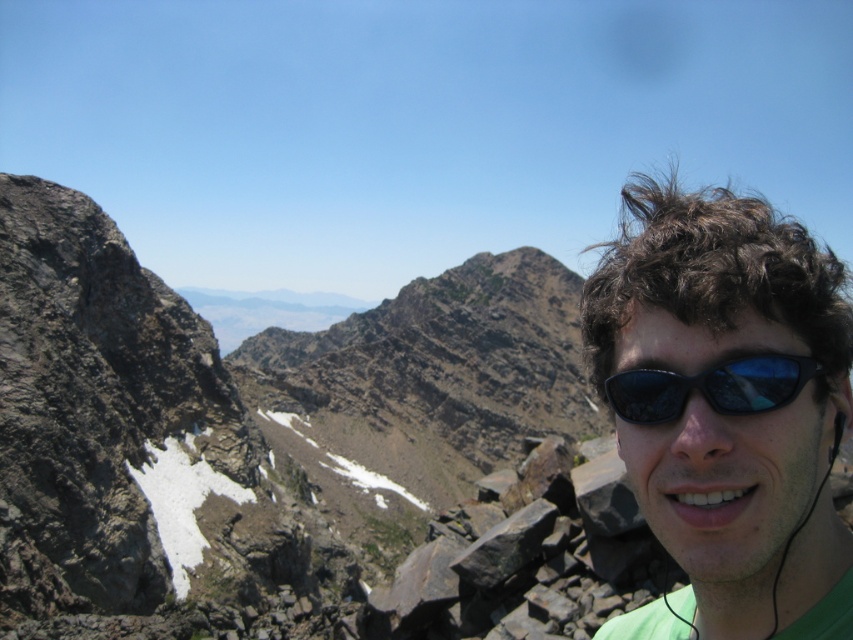
You are a photographer trying to capture the perfect shot of the green matte sunglasses at upper right and the black reflective sunglasses at right. Since you want to ensure both sunglasses are clearly visible in the frame, which sunglasses should you focus on first to avoid blurring due to their size differences?

The green matte sunglasses at upper right are wider than the black reflective sunglasses at right, so you should focus on the green matte sunglasses at upper right first to ensure clarity, as larger objects may require more precise focusing to avoid blurring.

You are a hiker standing at the center of the image. You want to take a photo of the brown rocky mountain at upper left. Which direction should you turn to face it?

The brown rocky mountain at upper left is located at point 0.620 on the x axis and 0.274 on the y axis. Since the mountain is at upper left, you should turn to your left to face it.